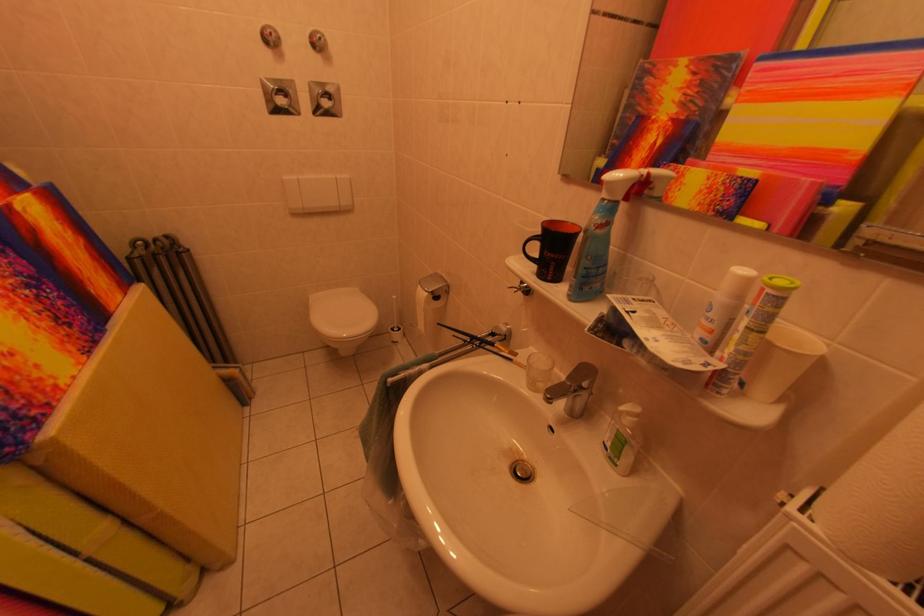
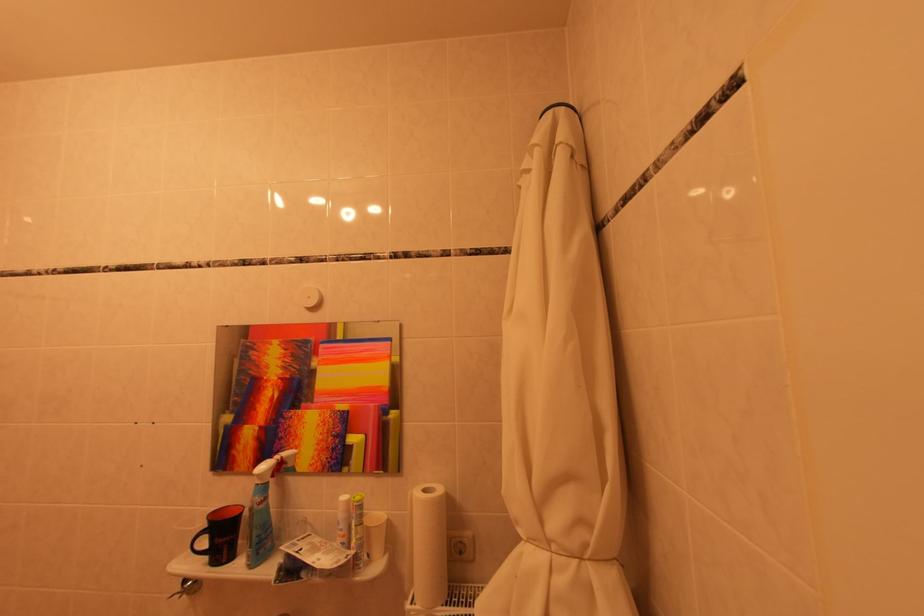
Where in the second image is the point corresponding to point 657,177 from the first image?

(290, 461)